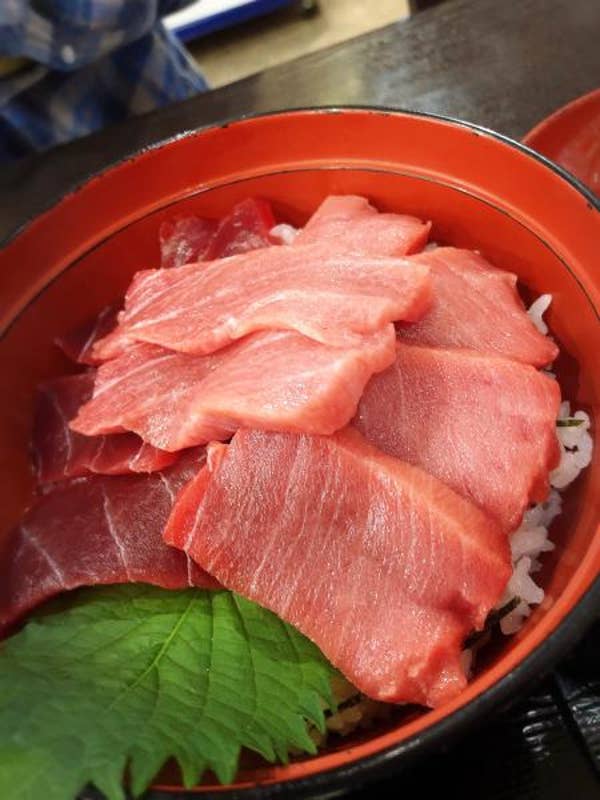
Locate an element on the screen. Image resolution: width=600 pixels, height=800 pixels. table is located at coordinates (439, 82).